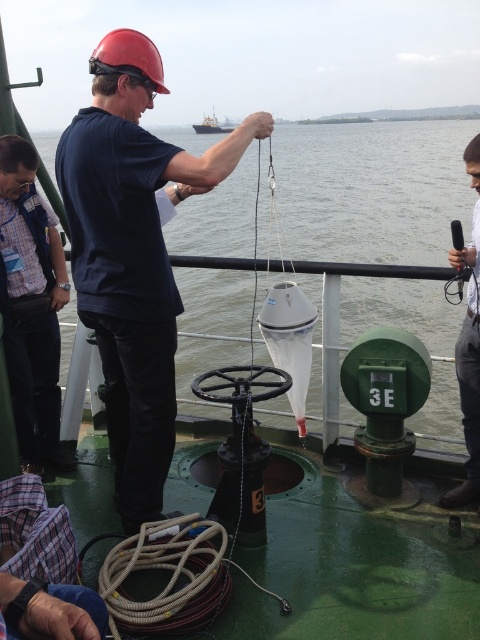
Question: Which point is closer to the camera taking this photo?

Choices:
 (A) (276, 150)
 (B) (218, 125)

Answer: (A)

Question: Is matte black shirt at center to the left of white plastic boat at upper center from the viewer's perspective?

Choices:
 (A) no
 (B) yes

Answer: (A)

Question: Which point appears closest to the camera in this image?

Choices:
 (A) click(224, 202)
 (B) click(472, 436)
 (C) click(32, 426)
 (D) click(233, 128)

Answer: (B)

Question: Which object appears closest to the camera in this image?

Choices:
 (A) matte black shirt at center
 (B) brushed metal shirt at left
 (C) gray fabric shirt at right
 (D) white plastic boat at upper center

Answer: (A)

Question: Considering the relative positions of brushed metal shirt at left and gray fabric shirt at right in the image provided, where is brushed metal shirt at left located with respect to gray fabric shirt at right?

Choices:
 (A) right
 (B) left

Answer: (B)

Question: Is the position of brushed metal shirt at left less distant than that of gray fabric shirt at right?

Choices:
 (A) yes
 (B) no

Answer: (B)